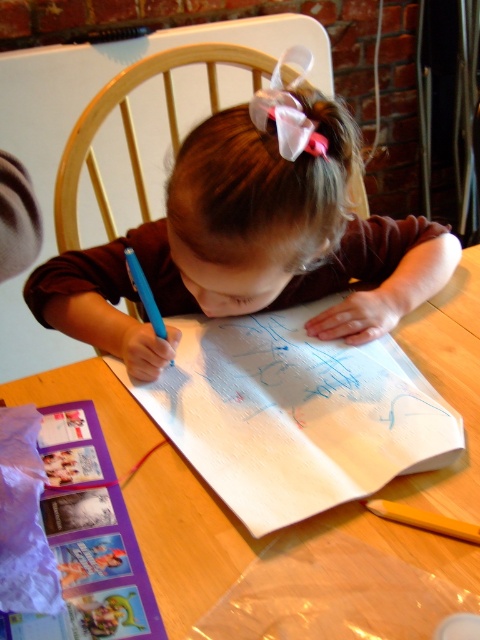
In the scene shown: You are standing in front of the wooden table at center. If you want to place a 12 inch long ruler on the table, will it fit entirely on the table without hanging over the edge?

The wooden table at center is 16.78 inches away from the viewer, but this distance does not indicate the table size. The question about the ruler fitting cannot be answered with the provided information.

You need to place a new drawing on the table. The drawing is the same size as the white textured paper at center. Will it fit on the wooden table at center?

The white textured paper at center is smaller than the wooden table at center, so the new drawing will fit on the wooden table at center.

You are a parent trying to place a small toy on the table without covering the child drawing. The toy is 2 inches wide. Can you place it between the white textured paper at center and the wooden table at center?

The white textured paper at center and wooden table at center are 2.67 inches apart, so yes, the toy can be placed between them since the space is wider than the toy.